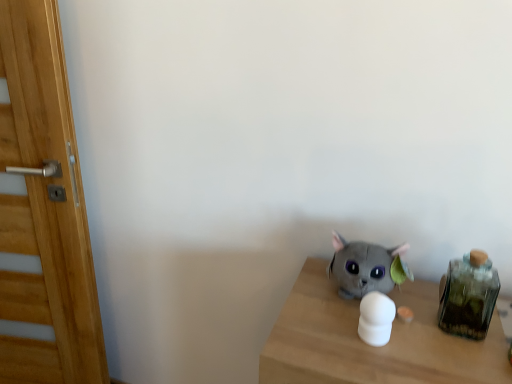
Question: Can you confirm if soft gray plush cat at center, arranged as the 2th toy when viewed from the front, is positioned to the left of green glass jar at right?

Choices:
 (A) no
 (B) yes

Answer: (B)

Question: Is soft gray plush cat at center, arranged as the 2th toy when viewed from the front, next to green glass jar at right and touching it?

Choices:
 (A) no
 (B) yes

Answer: (A)

Question: Can you confirm if soft gray plush cat at center, arranged as the 2th toy when viewed from the front, is smaller than green glass jar at right?

Choices:
 (A) no
 (B) yes

Answer: (A)

Question: Is soft gray plush cat at center, arranged as the 2th toy when viewed from the front, further to camera compared to green glass jar at right?

Choices:
 (A) yes
 (B) no

Answer: (A)

Question: Considering the relative sizes of soft gray plush cat at center, which is counted as the 1th toy, starting from the back, and green glass jar at right in the image provided, is soft gray plush cat at center, which is counted as the 1th toy, starting from the back, wider than green glass jar at right?

Choices:
 (A) no
 (B) yes

Answer: (B)

Question: From a real-world perspective, is green glass jar at right positioned above or below wooden door at left?

Choices:
 (A) above
 (B) below

Answer: (A)

Question: Considering the relative positions of green glass jar at right and wooden door at left in the image provided, is green glass jar at right to the left or to the right of wooden door at left?

Choices:
 (A) left
 (B) right

Answer: (B)

Question: In terms of width, does green glass jar at right look wider or thinner when compared to wooden door at left?

Choices:
 (A) thin
 (B) wide

Answer: (B)

Question: Considering the positions of point (467, 271) and point (45, 122), is point (467, 271) closer or farther from the camera than point (45, 122)?

Choices:
 (A) closer
 (B) farther

Answer: (A)

Question: Considering the positions of green glass jar at right and soft gray plush cat at center, arranged as the 2th toy when viewed from the front, in the image, is green glass jar at right taller or shorter than soft gray plush cat at center, arranged as the 2th toy when viewed from the front,?

Choices:
 (A) tall
 (B) short

Answer: (A)

Question: Based on their sizes in the image, would you say green glass jar at right is bigger or smaller than soft gray plush cat at center, which is counted as the 1th toy, starting from the back?

Choices:
 (A) small
 (B) big

Answer: (A)

Question: Is green glass jar at right spatially inside soft gray plush cat at center, which is counted as the 1th toy, starting from the back, or outside of it?

Choices:
 (A) inside
 (B) outside

Answer: (B)

Question: Does point (457, 289) appear closer or farther from the camera than point (354, 241)?

Choices:
 (A) closer
 (B) farther

Answer: (A)

Question: Considering the positions of white matte object at center, which is counted as the first toy, starting from the front, and wooden door at left in the image, is white matte object at center, which is counted as the first toy, starting from the front, wider or thinner than wooden door at left?

Choices:
 (A) wide
 (B) thin

Answer: (B)

Question: From a real-world perspective, is white matte object at center, which is counted as the first toy, starting from the front, positioned above or below wooden door at left?

Choices:
 (A) below
 (B) above

Answer: (B)